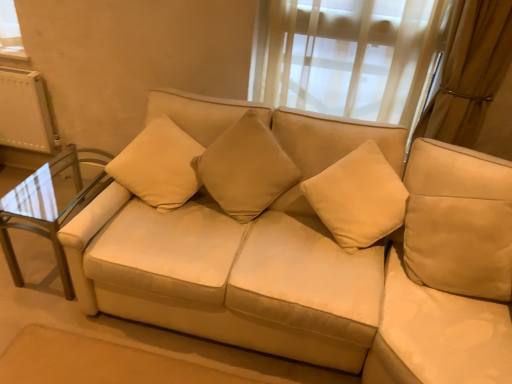
What do you see at coordinates (159, 165) in the screenshot?
I see `beige fabric pillow at upper left, arranged as the first pillow when viewed from the left` at bounding box center [159, 165].

At what (x,y) coordinates should I click in order to perform the action: click on beige fabric pillow at upper left, which is counted as the 2th pillow, starting from the right. Please return your answer as a coordinate pair (x, y). This screenshot has height=384, width=512. Looking at the image, I should click on (159, 165).

Identify the location of beige fabric pillow at upper left, arranged as the first pillow when viewed from the left. (159, 165).

Is clear glass table at left beside suede-like beige pillow at center, which is the first pillow in right-to-left order?

No, clear glass table at left is not making contact with suede-like beige pillow at center, which is the first pillow in right-to-left order.

Does point (64, 177) come closer to viewer compared to point (276, 181)?

That is False.

Can you confirm if clear glass table at left is bigger than suede-like beige pillow at center, which is the first pillow in right-to-left order?

Yes, clear glass table at left is bigger than suede-like beige pillow at center, which is the first pillow in right-to-left order.

Can you confirm if beige fabric pillow at upper left, arranged as the first pillow when viewed from the left, is shorter than clear glass table at left?

No, beige fabric pillow at upper left, arranged as the first pillow when viewed from the left, is not shorter than clear glass table at left.

Would you say beige fabric pillow at upper left, arranged as the first pillow when viewed from the left, is outside clear glass table at left?

Yes, beige fabric pillow at upper left, arranged as the first pillow when viewed from the left, is located beyond the bounds of clear glass table at left.

Does beige fabric pillow at upper left, which is counted as the 2th pillow, starting from the right, turn towards clear glass table at left?

No, beige fabric pillow at upper left, which is counted as the 2th pillow, starting from the right, is not oriented towards clear glass table at left.

Which of these two, beige fabric pillow at upper left, which is counted as the 2th pillow, starting from the right, or clear glass table at left, is thinner?

beige fabric pillow at upper left, which is counted as the 2th pillow, starting from the right, is thinner.

Where is `the 2nd pillow directly above the clear glass table at left (from a real-world perspective)`? the 2nd pillow directly above the clear glass table at left (from a real-world perspective) is located at coordinates (246, 168).

Is suede-like beige pillow at center, which is the first pillow in right-to-left order, next to clear glass table at left?

No, suede-like beige pillow at center, which is the first pillow in right-to-left order, is not in contact with clear glass table at left.

In the scene shown: Is suede-like beige pillow at center, which is the 2th pillow from left to right, looking in the opposite direction of clear glass table at left?

No, suede-like beige pillow at center, which is the 2th pillow from left to right,'s orientation is not away from clear glass table at left.

Is clear glass table at left looking in the opposite direction of beige fabric pillow at upper left, which is counted as the 2th pillow, starting from the right?

clear glass table at left is not turned away from beige fabric pillow at upper left, which is counted as the 2th pillow, starting from the right.

Does clear glass table at left come behind beige fabric pillow at upper left, arranged as the first pillow when viewed from the left?

Yes.

Is beige fabric pillow at upper left, which is counted as the 2th pillow, starting from the right, oriented away from beige fabric couch at center?

Yes.

How different are the orientations of beige fabric pillow at upper left, which is counted as the 2th pillow, starting from the right, and beige fabric couch at center in degrees?

There is a 20.3-degree angle between the facing directions of beige fabric pillow at upper left, which is counted as the 2th pillow, starting from the right, and beige fabric couch at center.

Can you see beige fabric pillow at upper left, which is counted as the 2th pillow, starting from the right, touching beige fabric couch at center?

No.

From a real-world perspective, count 1st pillows upward from the beige fabric couch at center and point to it. Please provide its 2D coordinates.

[(159, 165)]

Based on the photo, is beige fabric cushion at right further to the viewer compared to suede-like beige pillow at center, which is the 2th pillow from left to right?

No, the depth of beige fabric cushion at right is less than that of suede-like beige pillow at center, which is the 2th pillow from left to right.

Looking at this image, is beige fabric cushion at right located outside suede-like beige pillow at center, which is the 2th pillow from left to right?

Yes, beige fabric cushion at right is located beyond the bounds of suede-like beige pillow at center, which is the 2th pillow from left to right.

At what (x,y) coordinates should I click in order to perform the action: click on beige lying in front of the suede-like beige pillow at center, which is the first pillow in right-to-left order. Please return your answer as a coordinate pair (x, y). The image size is (512, 384). Looking at the image, I should click on (449, 273).

From the image's perspective, which object appears higher, beige fabric cushion at right or suede-like beige pillow at center, which is the first pillow in right-to-left order?

suede-like beige pillow at center, which is the first pillow in right-to-left order, appears higher in the image.

Is beige fabric pillow at upper left, arranged as the first pillow when viewed from the left, to the left of suede-like beige pillow at center, which is the first pillow in right-to-left order, from the viewer's perspective?

Correct, you'll find beige fabric pillow at upper left, arranged as the first pillow when viewed from the left, to the left of suede-like beige pillow at center, which is the first pillow in right-to-left order.

Is beige fabric pillow at upper left, arranged as the first pillow when viewed from the left, positioned behind suede-like beige pillow at center, which is the 2th pillow from left to right?

Yes, it is behind suede-like beige pillow at center, which is the 2th pillow from left to right.

From their relative heights in the image, would you say beige fabric pillow at upper left, arranged as the first pillow when viewed from the left, is taller or shorter than suede-like beige pillow at center, which is the 2th pillow from left to right?

Clearly, beige fabric pillow at upper left, arranged as the first pillow when viewed from the left, is shorter compared to suede-like beige pillow at center, which is the 2th pillow from left to right.

From the image's perspective, would you say beige fabric pillow at upper left, arranged as the first pillow when viewed from the left, is shown under suede-like beige pillow at center, which is the first pillow in right-to-left order?

No, from the image's perspective, beige fabric pillow at upper left, arranged as the first pillow when viewed from the left, is not beneath suede-like beige pillow at center, which is the first pillow in right-to-left order.

I want to click on the 2nd pillow located above the clear glass table at left (from a real-world perspective), so click(246, 168).

Find the location of a particular element. The height and width of the screenshot is (384, 512). table located on the left of beige fabric pillow at upper left, arranged as the first pillow when viewed from the left is located at coordinates (50, 205).

Based on their spatial positions, is beige fabric couch at center or beige fabric pillow at upper left, arranged as the first pillow when viewed from the left, further from beige fabric cushion at right?

Based on the image, beige fabric pillow at upper left, arranged as the first pillow when viewed from the left, appears to be further to beige fabric cushion at right.

Looking at this image, based on their spatial positions, is beige fabric pillow at upper left, arranged as the first pillow when viewed from the left, or clear glass table at left further from suede-like beige pillow at center, which is the first pillow in right-to-left order?

clear glass table at left.

Looking at this image, when comparing their distances from beige fabric couch at center, does beige fabric pillow at upper left, arranged as the first pillow when viewed from the left, or beige fabric cushion at right seem closer?

beige fabric cushion at right.

Considering their positions, is beige fabric pillow at upper left, which is counted as the 2th pillow, starting from the right, positioned further to clear glass table at left than suede-like beige pillow at center, which is the 2th pillow from left to right?

Among the two, suede-like beige pillow at center, which is the 2th pillow from left to right, is located further to clear glass table at left.

From the image, which object appears to be nearer to beige fabric couch at center, clear glass table at left or suede-like beige pillow at center, which is the 2th pillow from left to right?

suede-like beige pillow at center, which is the 2th pillow from left to right, is positioned closer to the anchor beige fabric couch at center.

From the image, which object appears to be nearer to clear glass table at left, beige fabric pillow at upper left, which is counted as the 2th pillow, starting from the right, or beige fabric cushion at right?

beige fabric pillow at upper left, which is counted as the 2th pillow, starting from the right.

Based on their spatial positions, is beige fabric couch at center or suede-like beige pillow at center, which is the 2th pillow from left to right, closer to beige fabric pillow at upper left, which is counted as the 2th pillow, starting from the right?

suede-like beige pillow at center, which is the 2th pillow from left to right, lies closer to beige fabric pillow at upper left, which is counted as the 2th pillow, starting from the right, than the other object.

From the image, which object appears to be farther from beige fabric cushion at right, suede-like beige pillow at center, which is the first pillow in right-to-left order, or clear glass table at left?

The object further to beige fabric cushion at right is clear glass table at left.

Find the location of a particular element. The height and width of the screenshot is (384, 512). pillow between clear glass table at left and beige fabric couch at center is located at coordinates (159, 165).

This screenshot has height=384, width=512. What are the coordinates of `studio couch between clear glass table at left and suede-like beige pillow at center, which is the first pillow in right-to-left order` in the screenshot? It's located at (315, 247).

Image resolution: width=512 pixels, height=384 pixels. I want to click on pillow located between beige fabric couch at center and beige fabric cushion at right in the left-right direction, so click(246, 168).

Find the location of a particular element. The height and width of the screenshot is (384, 512). pillow located between clear glass table at left and suede-like beige pillow at center, which is the first pillow in right-to-left order, in the left-right direction is located at coordinates (159, 165).